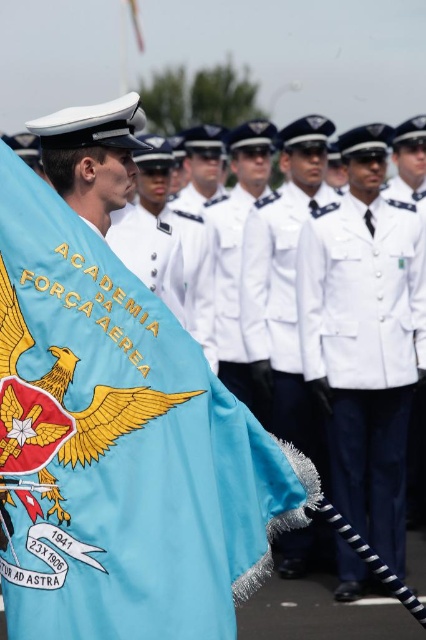
Does light blue fabric flag at center have a lesser height compared to white matte uniform at center?

Yes, light blue fabric flag at center is shorter than white matte uniform at center.

Is light blue fabric flag at center smaller than white matte uniform at center?

Correct, light blue fabric flag at center occupies less space than white matte uniform at center.

What are the coordinates of `light blue fabric flag at center` in the screenshot? It's located at (120, 445).

The height and width of the screenshot is (640, 426). Identify the location of light blue fabric flag at center. (120, 445).